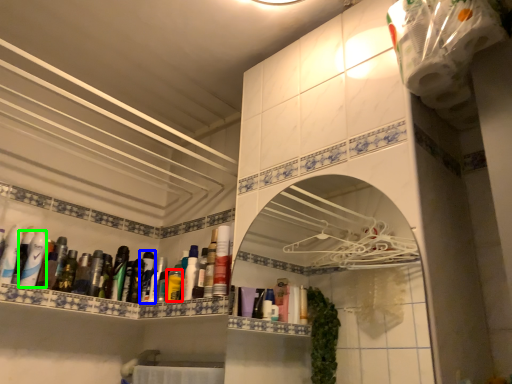
Question: Estimate the real-world distances between objects in this image. Which object is closer to mouthwash (highlighted by a red box), mouthwash (highlighted by a blue box) or mouthwash (highlighted by a green box)?

Choices:
 (A) mouthwash
 (B) mouthwash

Answer: (A)